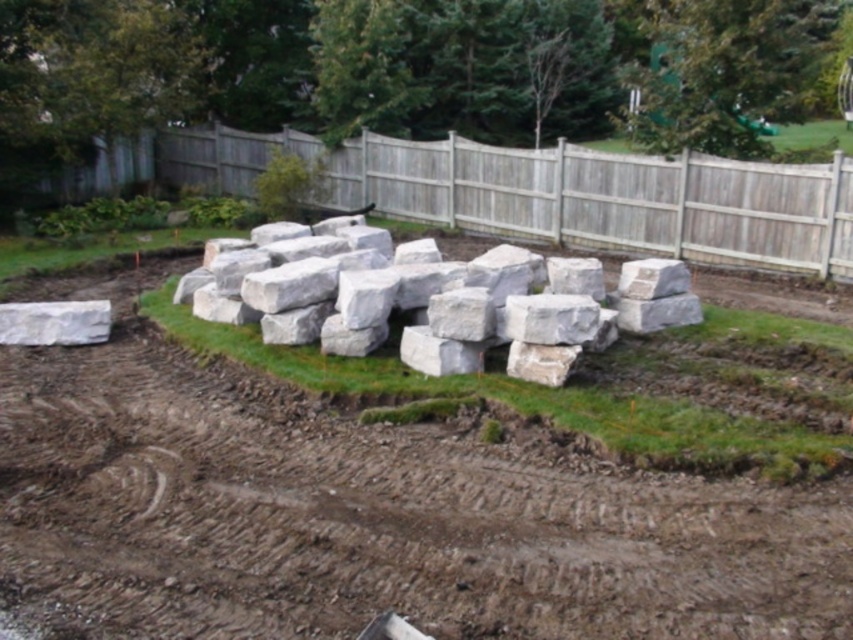
Is white marble stones at center shorter than white smooth boulder at left?

Incorrect, white marble stones at center's height does not fall short of white smooth boulder at left's.

Can you confirm if white marble stones at center is thinner than white smooth boulder at left?

Incorrect, white marble stones at center's width is not less than white smooth boulder at left's.

You are a GUI agent. You are given a task and a screenshot of the screen. Output one action in this format:
    pyautogui.click(x=<x>, y=<y>)
    Task: Click on the white marble stones at center
    Image resolution: width=853 pixels, height=640 pixels.
    Given the screenshot: What is the action you would take?
    pyautogui.click(x=451, y=305)

Can you confirm if brown soil at lower left is shorter than white smooth boulder at left?

Indeed, brown soil at lower left has a lesser height compared to white smooth boulder at left.

Can you confirm if brown soil at lower left is wider than white smooth boulder at left?

In fact, brown soil at lower left might be narrower than white smooth boulder at left.

Who is more forward, (677, 616) or (73, 301)?

Point (677, 616) is more forward.

Find the location of a particular element. The width and height of the screenshot is (853, 640). brown soil at lower left is located at coordinates (364, 515).

Does point (248, 186) lie in front of point (270, 332)?

No, (248, 186) is behind (270, 332).

Consider the image. Can you confirm if gray wood fence at center is shorter than white marble stones at center?

Incorrect, gray wood fence at center's height does not fall short of white marble stones at center's.

Between point (183, 177) and point (576, 305), which one is positioned behind?

Point (183, 177)

You are a GUI agent. You are given a task and a screenshot of the screen. Output one action in this format:
    pyautogui.click(x=<x>, y=<y>)
    Task: Click on the gray wood fence at center
    This screenshot has height=640, width=853.
    Given the screenshot: What is the action you would take?
    pyautogui.click(x=527, y=193)